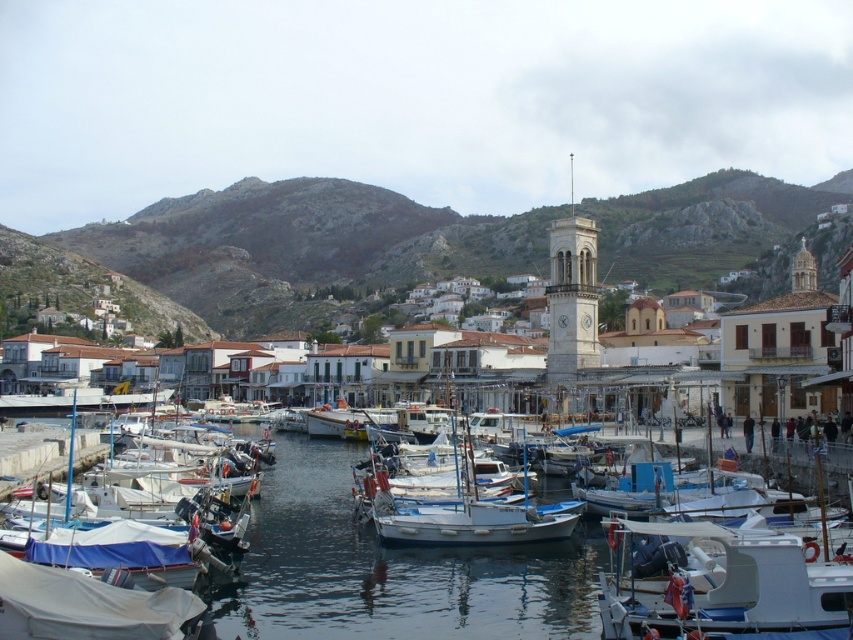
You are standing at the harbor and want to determine the relative positions of two points marked in the scene. Which point, point (708, 588) or point (73, 458), is nearer to your current position?

Point (708, 588) is closer to the viewer than point (73, 458).

You are standing at the dock looking out at the harbor. There is a point marked at coordinates point (392,568). What is located at this point?

The point (392,568) corresponds to the smooth blue water at center.

You are standing at the edge of the harbor looking towards the town. According to the coordinates provided, where exactly are the white matte buildings at center located in the scene?

The white matte buildings at center are located at coordinates point (293, 248).